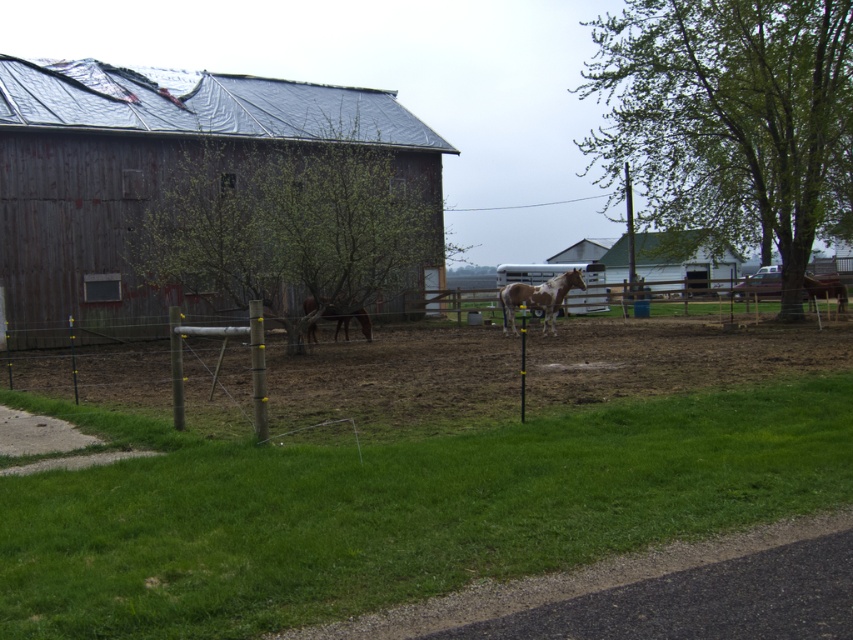
Can you confirm if rusty wood barn at left is shorter than speckled brown horse at center?

Incorrect, rusty wood barn at left's height does not fall short of speckled brown horse at center's.

Who is positioned more to the right, rusty wood barn at left or speckled brown horse at center?

From the viewer's perspective, speckled brown horse at center appears more on the right side.

This screenshot has width=853, height=640. Describe the element at coordinates (204, 193) in the screenshot. I see `rusty wood barn at left` at that location.

Identify the location of rusty wood barn at left. (204, 193).

Which is below, white wooden barn at center or speckled brown horse at center?

speckled brown horse at center is below.

Between white wooden barn at center and speckled brown horse at center, which one appears on the right side from the viewer's perspective?

From the viewer's perspective, white wooden barn at center appears more on the right side.

Between point (635, 250) and point (553, 296), which one is positioned in front?

Positioned in front is point (553, 296).

You are a GUI agent. You are given a task and a screenshot of the screen. Output one action in this format:
    pyautogui.click(x=<x>, y=<y>)
    Task: Click on the white wooden barn at center
    This screenshot has height=640, width=853.
    Given the screenshot: What is the action you would take?
    pyautogui.click(x=683, y=260)

Between green grass at lower center and white wooden barn at center, which one has less height?

Standing shorter between the two is green grass at lower center.

The image size is (853, 640). I want to click on green grass at lower center, so click(395, 509).